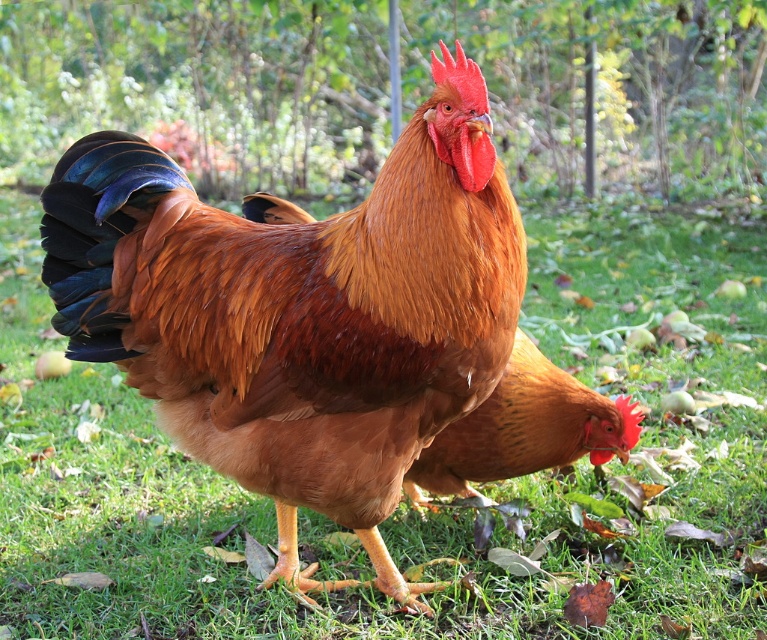
Looking at this image, you are standing in the garden looking at the two chickens. There are two points marked in the image. Which point, point (425, 227) or point (555, 433), is closer to you?

Point (425, 227) is closer to the viewer than point (555, 433).

You are standing in the garden and want to take a photo of the shiny brown rooster at center. If you are facing north, which direction should you move to get the rooster in the frame?

The shiny brown rooster at center is located at coordinates (300,314). Since you are facing north, you should move south to position yourself closer to the rooster for a better shot.